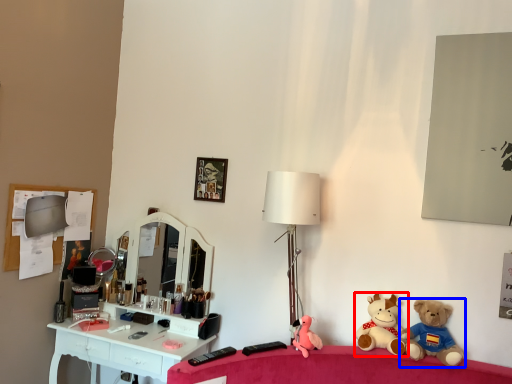
Question: Which point is closer to the camera, toy (highlighted by a red box) or toy (highlighted by a blue box)?

Choices:
 (A) toy
 (B) toy

Answer: (B)